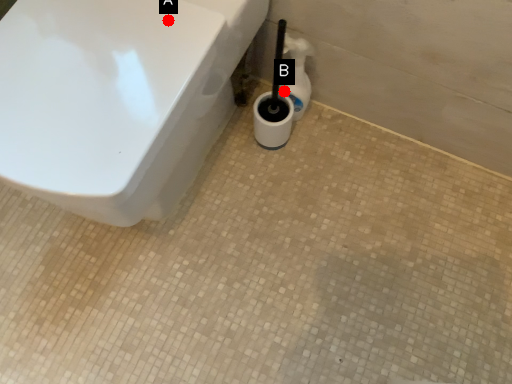
Question: Two points are circled on the image, labeled by A and B beside each circle. Among these points, which one is farthest from the camera?

Choices:
 (A) A is further
 (B) B is further

Answer: (B)